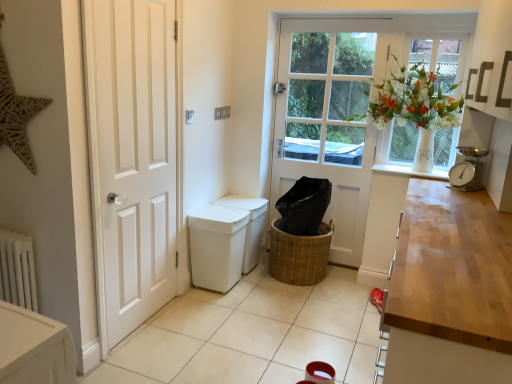
Image resolution: width=512 pixels, height=384 pixels. Find the location of `free spot to the right of white plastic bin at lower center`. free spot to the right of white plastic bin at lower center is located at coordinates (259, 296).